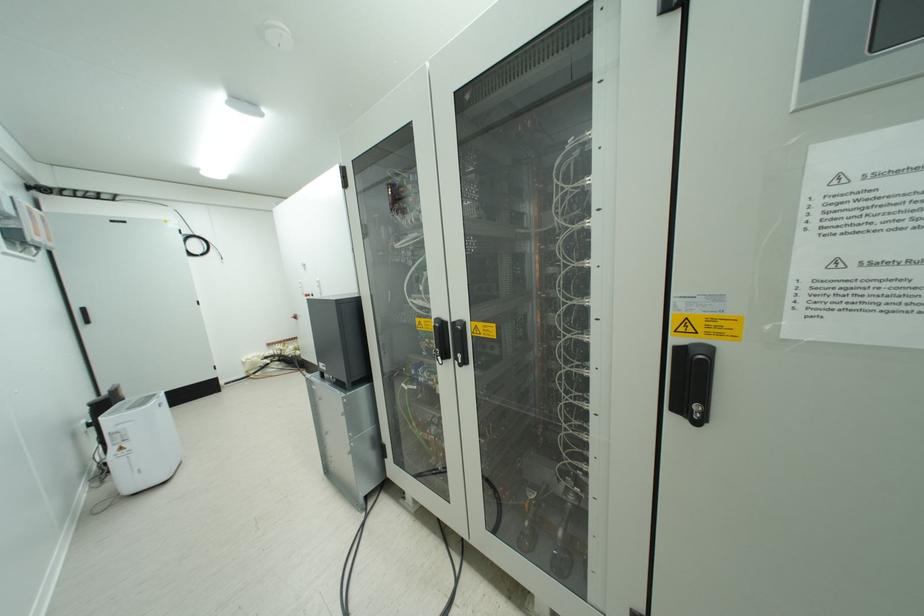
Locate an element on the screen. black recessed handle is located at coordinates (690, 381).